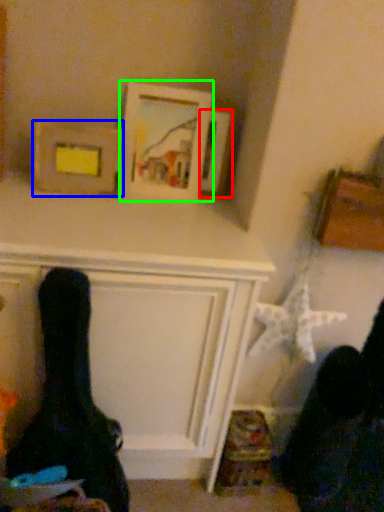
Question: Which object is positioned farthest from picture frame (highlighted by a red box)? Select from picture frame (highlighted by a blue box) and picture frame (highlighted by a green box).

Choices:
 (A) picture frame
 (B) picture frame

Answer: (A)